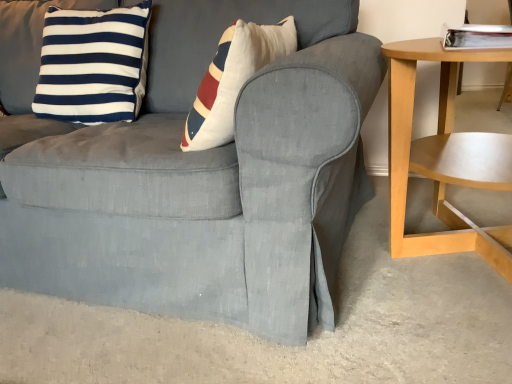
This screenshot has width=512, height=384. What do you see at coordinates (93, 64) in the screenshot?
I see `navy blue/white striped cushion at upper left` at bounding box center [93, 64].

Measure the distance between point (135, 257) and camera.

Point (135, 257) is 1.02 meters away from camera.

Identify the location of light wood/woodenobject at right. The height and width of the screenshot is (384, 512). (444, 157).

Does point (53, 88) lie in front of point (284, 7)?

No, it is not.

Is navy blue/white striped cushion at upper left behind matte gray slipcover at center?

Yes, it is behind matte gray slipcover at center.

How far apart are navy blue/white striped cushion at upper left and matte gray slipcover at center?

A distance of 35.34 centimeters exists between navy blue/white striped cushion at upper left and matte gray slipcover at center.

From the image's perspective, which object appears higher, navy blue/white striped cushion at upper left or matte gray slipcover at center?

navy blue/white striped cushion at upper left, from the image's perspective.

At what (x,y) coordinates should I click in order to perform the action: click on table that is below the matte gray slipcover at center (from the image's perspective). Please return your answer as a coordinate pair (x, y). Looking at the image, I should click on (444, 157).

Would you say matte gray slipcover at center is a long distance from light wood/woodenobject at right?

No, matte gray slipcover at center is not far from light wood/woodenobject at right.

From the image's perspective, is matte gray slipcover at center beneath light wood/woodenobject at right?

Actually, matte gray slipcover at center appears above light wood/woodenobject at right in the image.

Is point (321, 67) positioned before point (471, 155)?

Yes, it is in front of point (471, 155).

Which is farther from the camera, (x=497, y=235) or (x=100, y=29)?

The point (x=100, y=29) is more distant.

Is light wood/woodenobject at right with navy blue/white striped cushion at upper left?

No, light wood/woodenobject at right is not beside navy blue/white striped cushion at upper left.

Does light wood/woodenobject at right have a greater width compared to navy blue/white striped cushion at upper left?

Correct, the width of light wood/woodenobject at right exceeds that of navy blue/white striped cushion at upper left.

From a real-world perspective, is light wood/woodenobject at right located higher than navy blue/white striped cushion at upper left?

No.

The image size is (512, 384). Identify the location of table located underneath the matte gray slipcover at center (from a real-world perspective). (444, 157).

Can we say light wood/woodenobject at right lies outside matte gray slipcover at center?

Yes, light wood/woodenobject at right is located beyond the bounds of matte gray slipcover at center.

Who is bigger, light wood/woodenobject at right or matte gray slipcover at center?

matte gray slipcover at center.

Is light wood/woodenobject at right facing towards matte gray slipcover at center?

No.

Are matte gray slipcover at center and navy blue/white striped cushion at upper left making contact?

No, matte gray slipcover at center is not making contact with navy blue/white striped cushion at upper left.

Considering the sizes of objects matte gray slipcover at center and navy blue/white striped cushion at upper left in the image provided, who is shorter, matte gray slipcover at center or navy blue/white striped cushion at upper left?

navy blue/white striped cushion at upper left.

Is matte gray slipcover at center spatially inside navy blue/white striped cushion at upper left, or outside of it?

matte gray slipcover at center exists outside the volume of navy blue/white striped cushion at upper left.

Which of these two, navy blue/white striped cushion at upper left or light wood/woodenobject at right, is wider?

light wood/woodenobject at right.

From the image's perspective, between navy blue/white striped cushion at upper left and light wood/woodenobject at right, who is located below?

From the image's view, light wood/woodenobject at right is below.

In terms of size, does navy blue/white striped cushion at upper left appear bigger or smaller than light wood/woodenobject at right?

Clearly, navy blue/white striped cushion at upper left is smaller in size than light wood/woodenobject at right.

Is navy blue/white striped cushion at upper left at the right side of light wood/woodenobject at right?

No, navy blue/white striped cushion at upper left is not to the right of light wood/woodenobject at right.

You are a GUI agent. You are given a task and a screenshot of the screen. Output one action in this format:
    pyautogui.click(x=<x>, y=<y>)
    Task: Click on the pillow that appears behind the matte gray slipcover at center
    The image size is (512, 384).
    Given the screenshot: What is the action you would take?
    coord(93,64)

You are a GUI agent. You are given a task and a screenshot of the screen. Output one action in this format:
    pyautogui.click(x=<x>, y=<y>)
    Task: Click on the chair above the light wood/woodenobject at right (from a real-world perspective)
    Image resolution: width=512 pixels, height=384 pixels.
    Given the screenshot: What is the action you would take?
    pyautogui.click(x=206, y=181)

Which object lies nearer to the anchor point navy blue/white striped cushion at upper left, matte gray slipcover at center or light wood/woodenobject at right?

matte gray slipcover at center.

Consider the image. Looking at the image, which one is located closer to matte gray slipcover at center, light wood/woodenobject at right or navy blue/white striped cushion at upper left?

navy blue/white striped cushion at upper left.

Based on the photo, which object lies nearer to the anchor point navy blue/white striped cushion at upper left, light wood/woodenobject at right or matte gray slipcover at center?

Based on the image, matte gray slipcover at center appears to be nearer to navy blue/white striped cushion at upper left.

From the image, which object appears to be farther from matte gray slipcover at center, navy blue/white striped cushion at upper left or light wood/woodenobject at right?

Based on the image, light wood/woodenobject at right appears to be further to matte gray slipcover at center.

From the image, which object appears to be nearer to light wood/woodenobject at right, navy blue/white striped cushion at upper left or matte gray slipcover at center?

matte gray slipcover at center lies closer to light wood/woodenobject at right than the other object.

Looking at the image, which one is located closer to light wood/woodenobject at right, matte gray slipcover at center or navy blue/white striped cushion at upper left?

matte gray slipcover at center.

The image size is (512, 384). In order to click on pillow between matte gray slipcover at center and light wood/woodenobject at right in the horizontal direction in this screenshot , I will do `click(93, 64)`.